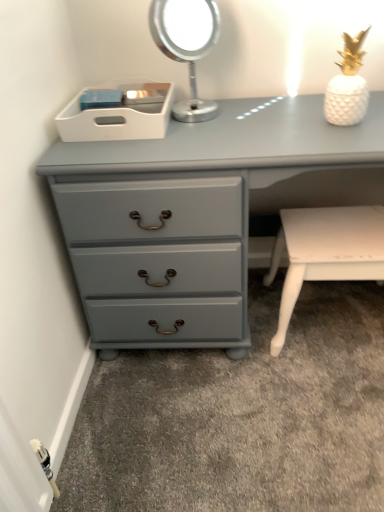
Locate an element on the screen. The height and width of the screenshot is (512, 384). vacant position to the left of white glossy table at lower right is located at coordinates (229, 365).